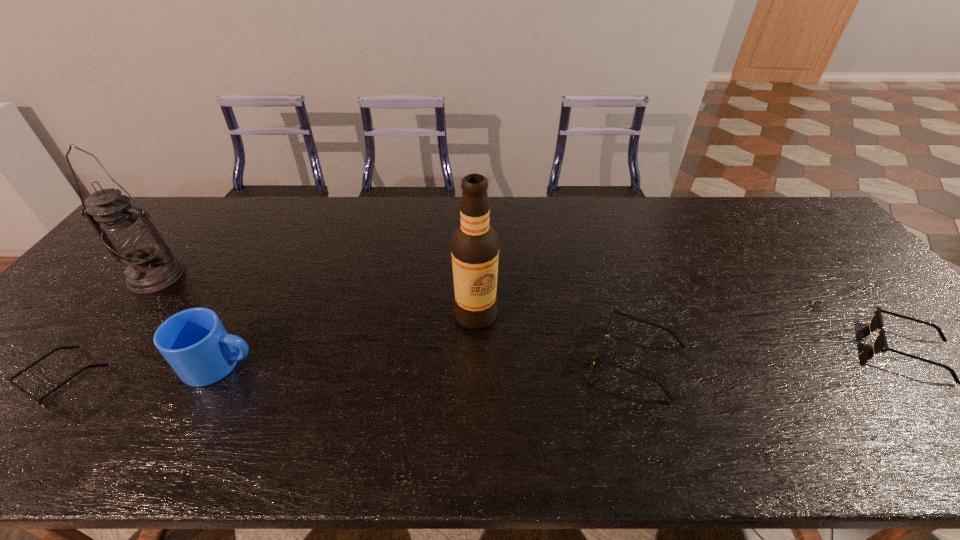
Choose which object is the nearest neighbor to the alcohol. Please provide its 2D coordinates. Your answer should be formatted as a tuple, i.e. [(x, y)], where the tuple contains the x and y coordinates of a point satisfying the conditions above.

[(661, 385)]

Find the location of `object that ranks as the fourth closest to the fifth object from left to right`. object that ranks as the fourth closest to the fifth object from left to right is located at coordinates (127, 233).

What are the coordinates of `the closest sunglasses relative to the leftmost sunglasses` in the screenshot? It's located at (661, 385).

Locate an element on the screen. the second closest sunglasses to the oil lamp is located at coordinates (661, 385).

Image resolution: width=960 pixels, height=540 pixels. What are the coordinates of `blank space that satisfies the following two spatial constraints: 1. on the label of the third object from right to left; 2. on the side of the third tallest object with the handle` in the screenshot? It's located at (475, 364).